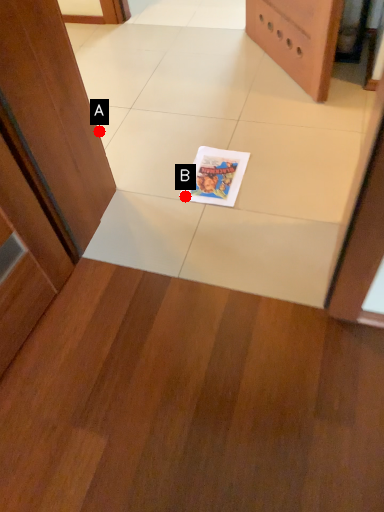
Question: Two points are circled on the image, labeled by A and B beside each circle. Which point is further to the camera?

Choices:
 (A) A is further
 (B) B is further

Answer: (A)